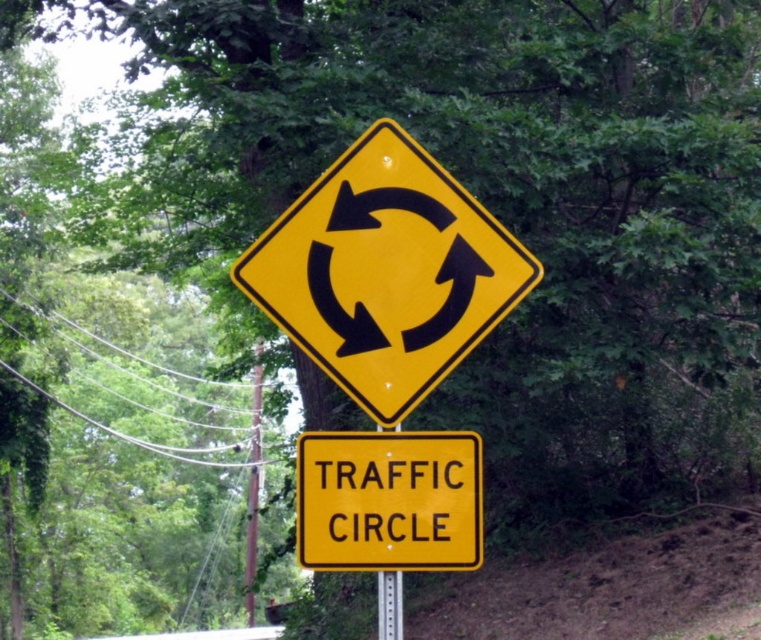
Is point (432, 467) more distant than point (250, 538)?

No, (432, 467) is closer to viewer.

Between yellow/yellowish metal/texture traffic circle at center and brown wooden pole at center, which one is positioned lower?

brown wooden pole at center

Find the location of `yellow/yellowish metal/texture traffic circle at center`. yellow/yellowish metal/texture traffic circle at center is located at coordinates (387, 500).

At what (x,y) coordinates should I click in order to perform the action: click on yellow/yellowish metal/texture traffic circle at center. Please return your answer as a coordinate pair (x, y). Looking at the image, I should click on (387, 500).

Is yellow reflective diamond at center further to the viewer compared to metallic silver pole at center?

No, it is not.

Can you confirm if yellow reflective diamond at center is thinner than metallic silver pole at center?

No, yellow reflective diamond at center is not thinner than metallic silver pole at center.

Describe the element at coordinates (384, 273) in the screenshot. I see `yellow reflective diamond at center` at that location.

Where is `yellow reflective diamond at center`? yellow reflective diamond at center is located at coordinates (384, 273).

Is point (250, 584) positioned after point (381, 627)?

Yes, it is.

Does brown wooden pole at center have a lesser width compared to metallic silver pole at center?

No, brown wooden pole at center is not thinner than metallic silver pole at center.

You are a GUI agent. You are given a task and a screenshot of the screen. Output one action in this format:
    pyautogui.click(x=<x>, y=<y>)
    Task: Click on the brown wooden pole at center
    The height and width of the screenshot is (640, 761).
    Given the screenshot: What is the action you would take?
    pyautogui.click(x=253, y=486)